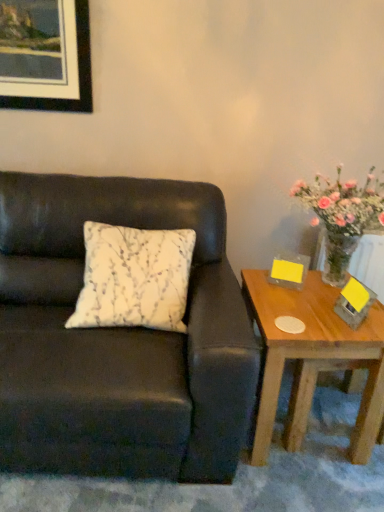
Question: Does matte black picture frame at upper left come in front of wooden table at right?

Choices:
 (A) yes
 (B) no

Answer: (B)

Question: Can you confirm if matte black picture frame at upper left is wider than wooden table at right?

Choices:
 (A) no
 (B) yes

Answer: (A)

Question: Is matte black picture frame at upper left further to camera compared to wooden table at right?

Choices:
 (A) yes
 (B) no

Answer: (A)

Question: Considering the relative sizes of matte black picture frame at upper left and wooden table at right in the image provided, is matte black picture frame at upper left taller than wooden table at right?

Choices:
 (A) yes
 (B) no

Answer: (B)

Question: Is matte black picture frame at upper left at the right side of wooden table at right?

Choices:
 (A) yes
 (B) no

Answer: (B)

Question: Looking at the image, does matte black couch at left seem bigger or smaller compared to wooden table at right?

Choices:
 (A) small
 (B) big

Answer: (B)

Question: Is point (168, 429) closer or farther from the camera than point (264, 449)?

Choices:
 (A) farther
 (B) closer

Answer: (B)

Question: Is matte black couch at left wider or thinner than wooden table at right?

Choices:
 (A) wide
 (B) thin

Answer: (A)

Question: Is matte black couch at left in front of or behind wooden table at right in the image?

Choices:
 (A) behind
 (B) front

Answer: (B)

Question: Is point (253, 455) closer or farther from the camera than point (112, 227)?

Choices:
 (A) closer
 (B) farther

Answer: (A)

Question: In the image, is wooden table at right positioned in front of or behind white printed cushion at center?

Choices:
 (A) behind
 (B) front

Answer: (A)

Question: From a real-world perspective, is wooden table at right physically located above or below white printed cushion at center?

Choices:
 (A) above
 (B) below

Answer: (B)

Question: From the image's perspective, is wooden table at right above or below white printed cushion at center?

Choices:
 (A) below
 (B) above

Answer: (A)

Question: Is wooden table at right wider or thinner than matte black picture frame at upper left?

Choices:
 (A) wide
 (B) thin

Answer: (A)

Question: Is wooden table at right situated inside matte black picture frame at upper left or outside?

Choices:
 (A) outside
 (B) inside

Answer: (A)